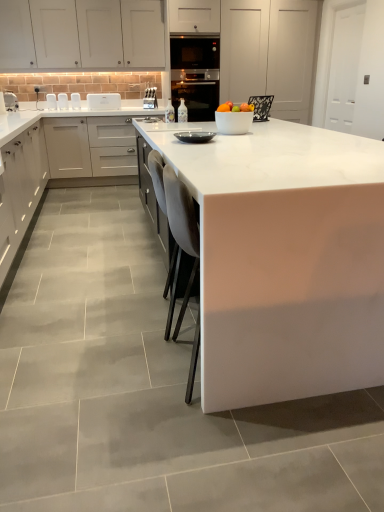
Question: Is white glossy countertop at center, which ranks as the first countertop in left-to-right order, positioned far away from white matte cabinet at left, the 1th cabinetry ordered from the bottom?

Choices:
 (A) yes
 (B) no

Answer: (B)

Question: Could you tell me if white glossy countertop at center, the 2th countertop positioned from the right, is facing white matte cabinet at left, the 1th cabinetry ordered from the bottom?

Choices:
 (A) yes
 (B) no

Answer: (A)

Question: From the image's perspective, is white glossy countertop at center, which ranks as the first countertop in left-to-right order, below white matte cabinet at left, the 3th cabinetry when ordered from top to bottom?

Choices:
 (A) yes
 (B) no

Answer: (B)

Question: Is white glossy countertop at center, the 2th countertop positioned from the right, directly adjacent to white matte cabinet at left, the 1th cabinetry ordered from the bottom?

Choices:
 (A) no
 (B) yes

Answer: (A)

Question: Is white glossy countertop at center, the 2th countertop positioned from the right, not within white matte cabinet at left, the 3th cabinetry when ordered from top to bottom?

Choices:
 (A) yes
 (B) no

Answer: (B)

Question: From a real-world perspective, relative to metallic knife block at center, which is the 1th appliance from back to front, is white matte cabinet at upper center, the first cabinetry in the top-to-bottom sequence, vertically above or below?

Choices:
 (A) below
 (B) above

Answer: (B)

Question: Considering the positions of white matte cabinet at upper center, the first cabinetry in the top-to-bottom sequence, and metallic knife block at center, which appears as the 3th appliance when viewed from the right, in the image, is white matte cabinet at upper center, the first cabinetry in the top-to-bottom sequence, bigger or smaller than metallic knife block at center, which appears as the 3th appliance when viewed from the right,?

Choices:
 (A) big
 (B) small

Answer: (A)

Question: Considering their positions, is white matte cabinet at upper center, the 3th cabinetry from the bottom, located in front of or behind metallic knife block at center, the fourth appliance positioned from the front?

Choices:
 (A) front
 (B) behind

Answer: (A)

Question: Is white matte cabinet at upper center, the first cabinetry in the top-to-bottom sequence, inside the boundaries of metallic knife block at center, the fourth appliance positioned from the front, or outside?

Choices:
 (A) inside
 (B) outside

Answer: (B)

Question: From their relative heights in the image, would you say white glossy microwave at upper center is taller or shorter than white glossy microwave at upper left, which is the 2th appliance from back to front?

Choices:
 (A) short
 (B) tall

Answer: (A)

Question: Is white glossy microwave at upper center inside or outside of white glossy microwave at upper left, the third appliance positioned from the bottom?

Choices:
 (A) inside
 (B) outside

Answer: (B)

Question: Considering the positions of white glossy microwave at upper center and white glossy microwave at upper left, positioned as the first appliance in left-to-right order, in the image, is white glossy microwave at upper center wider or thinner than white glossy microwave at upper left, positioned as the first appliance in left-to-right order,?

Choices:
 (A) thin
 (B) wide

Answer: (B)

Question: From the image's perspective, is white glossy microwave at upper center positioned above or below white glossy microwave at upper left, positioned as the first appliance in left-to-right order?

Choices:
 (A) above
 (B) below

Answer: (A)

Question: Considering their positions, is white glossy countertop at center, the 2th countertop positioned from the right, located in front of or behind black glass oven at center?

Choices:
 (A) behind
 (B) front

Answer: (B)

Question: From a real-world perspective, is white glossy countertop at center, the 2th countertop positioned from the right, physically located above or below black glass oven at center?

Choices:
 (A) above
 (B) below

Answer: (B)